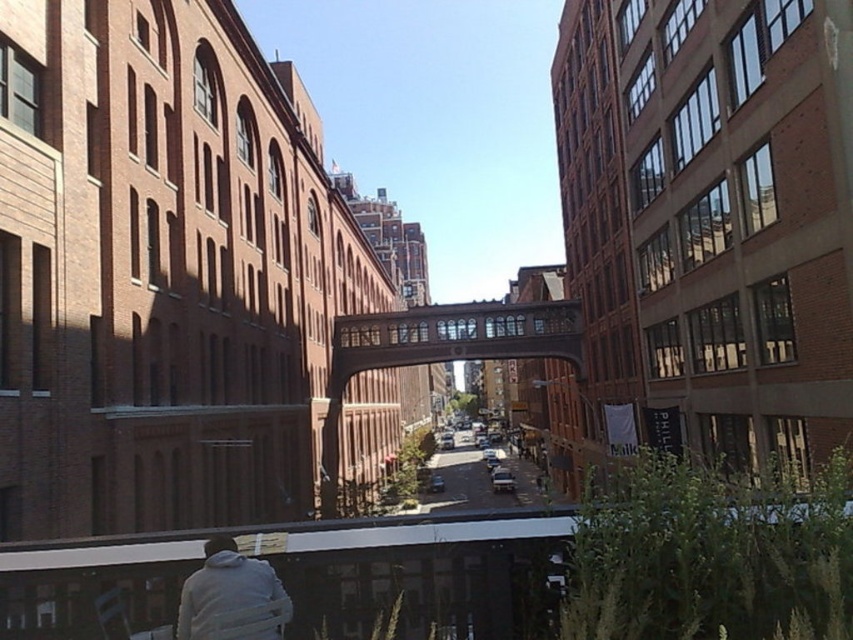
You are a delivery person needing to cross the street. You see the light gray hoodie at lower left and the smooth asphalt road at center. Which object is closer to you?

The light gray hoodie at lower left is closer to you because it is in front of the smooth asphalt road at center.

You are standing at the center of the pedestrian bridge between the two brick buildings. You want to locate the light gray hoodie at lower left. In which direction should you look relative to your position?

You should look to the lower left direction from your position on the pedestrian bridge to locate the light gray hoodie at lower left.